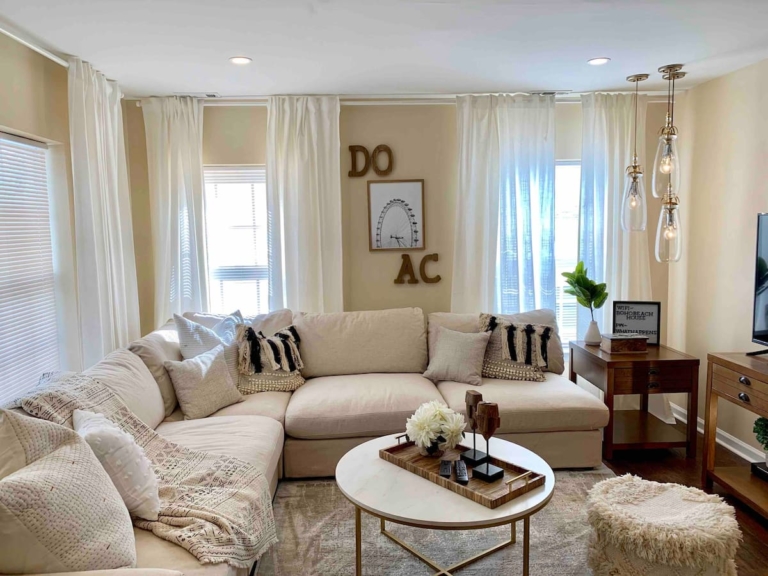
Find the location of a particular element. This screenshot has height=576, width=768. curtain rod is located at coordinates (233, 104), (442, 103), (657, 100), (27, 45).